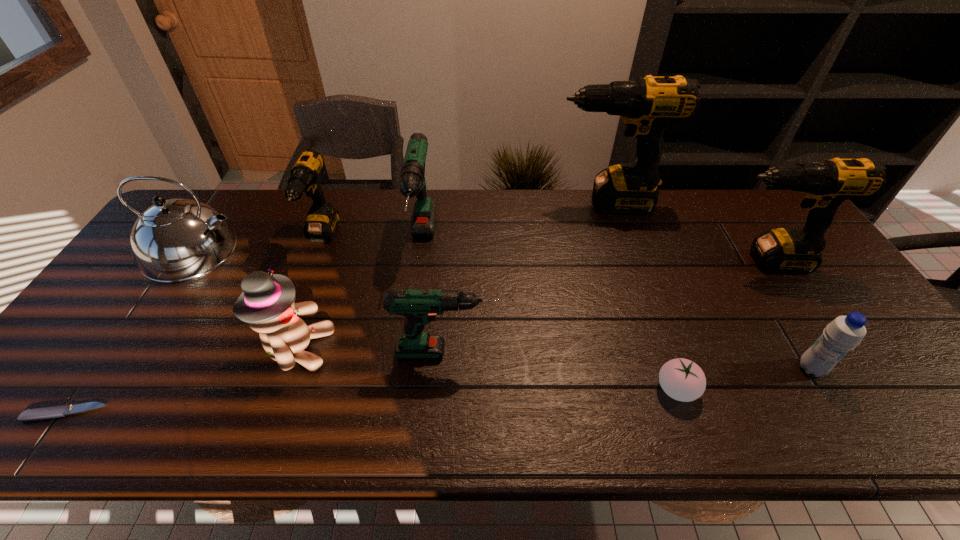
The image size is (960, 540). Find the location of `the nearest drill`. the nearest drill is located at coordinates (420, 307).

What are the coordinates of `water bottle` in the screenshot? It's located at (844, 333).

Where is `the ninth tallest object`? the ninth tallest object is located at coordinates (683, 380).

Where is `red tomato`? red tomato is located at coordinates (683, 380).

Locate an element on the screen. The height and width of the screenshot is (540, 960). the shortest object is located at coordinates (38, 414).

The width and height of the screenshot is (960, 540). In order to click on vacant space situated at the tip of the second black drill from right to left in this screenshot , I will do `click(454, 203)`.

Image resolution: width=960 pixels, height=540 pixels. I want to click on free space located 0.060m at the tip of the second black drill from right to left, so click(535, 203).

Find the location of a particular element. The height and width of the screenshot is (540, 960). free space located 0.080m at the tip of the second black drill from right to left is located at coordinates (529, 203).

Identify the location of free location located 0.280m at the tip of the second biggest black drill. (619, 261).

Identify the location of vacant space located 0.050m at the tip of the second biggest black drill. (698, 261).